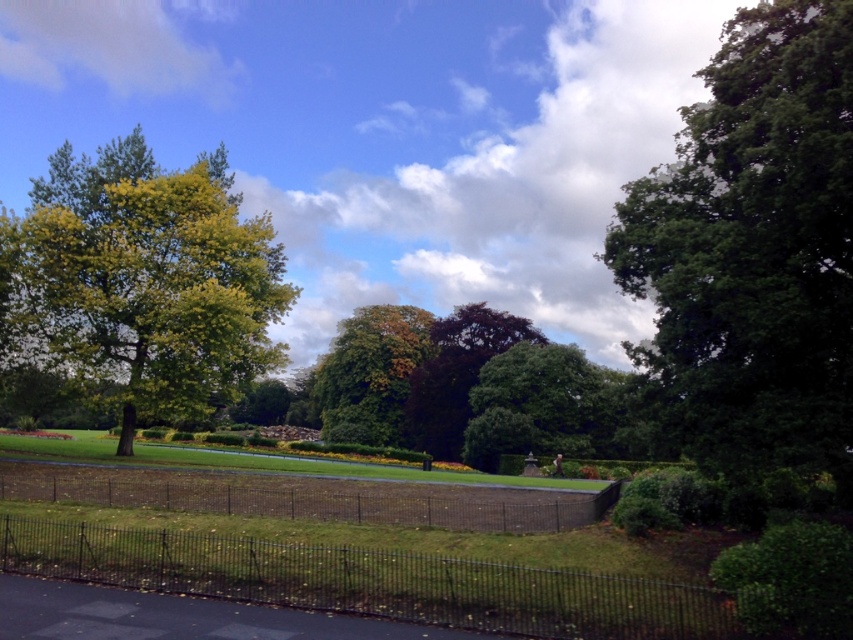
Is black metal fence at lower center closer to the viewer compared to green leafy tree at center?

Yes, it is in front of green leafy tree at center.

Between black metal fence at lower center and green leafy tree at center, which one has less height?

black metal fence at lower center is shorter.

This screenshot has width=853, height=640. Describe the element at coordinates (370, 580) in the screenshot. I see `black metal fence at lower center` at that location.

This screenshot has height=640, width=853. Identify the location of black metal fence at lower center. (370, 580).

Between black metal fence at lower center and dark green leafy tree at center, which one is positioned lower?

dark green leafy tree at center

The height and width of the screenshot is (640, 853). I want to click on black metal fence at lower center, so click(x=370, y=580).

You are a GUI agent. You are given a task and a screenshot of the screen. Output one action in this format:
    pyautogui.click(x=<x>, y=<y>)
    Task: Click on the black metal fence at lower center
    The width and height of the screenshot is (853, 640).
    Given the screenshot: What is the action you would take?
    pyautogui.click(x=370, y=580)

Looking at this image, which is above, green leafy tree at upper right or black metal fence at center?

green leafy tree at upper right is above.

Where is `green leafy tree at upper right`? This screenshot has width=853, height=640. green leafy tree at upper right is located at coordinates (753, 250).

Where is `green leafy tree at upper right`? Image resolution: width=853 pixels, height=640 pixels. green leafy tree at upper right is located at coordinates (753, 250).